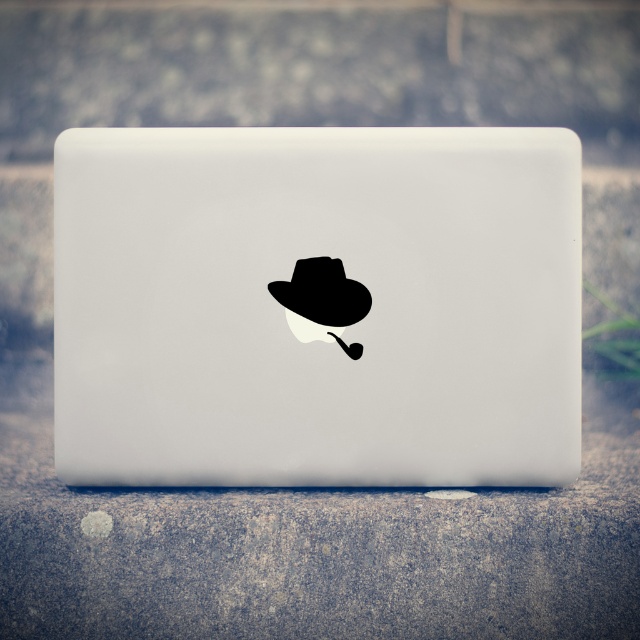
Question: Which point is closer to the camera?

Choices:
 (A) (122, 230)
 (B) (304, 275)

Answer: (B)

Question: Which of the following is the closest to the observer?

Choices:
 (A) white matte laptop at center
 (B) black matte fedora at center

Answer: (B)

Question: Does white matte laptop at center appear over black matte fedora at center?

Choices:
 (A) no
 (B) yes

Answer: (A)

Question: Does white matte laptop at center have a smaller size compared to black matte fedora at center?

Choices:
 (A) no
 (B) yes

Answer: (A)

Question: Is white matte laptop at center closer to camera compared to black matte fedora at center?

Choices:
 (A) no
 (B) yes

Answer: (A)